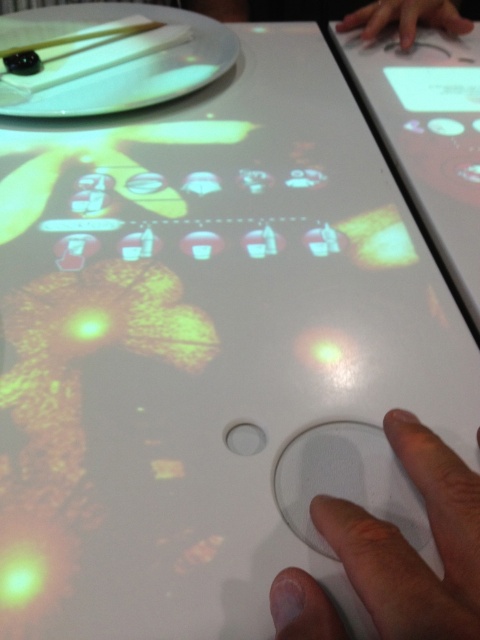
Question: Does transparent plastic hand at bottom right appear on the left side of smooth skin hand at upper right?

Choices:
 (A) yes
 (B) no

Answer: (A)

Question: Which object is farther from the camera taking this photo?

Choices:
 (A) transparent plastic hand at bottom right
 (B) smooth skin hand at upper right

Answer: (B)

Question: Does transparent plastic hand at bottom right have a smaller size compared to smooth skin hand at upper right?

Choices:
 (A) yes
 (B) no

Answer: (A)

Question: Does transparent plastic hand at bottom right have a greater width compared to smooth skin hand at upper right?

Choices:
 (A) yes
 (B) no

Answer: (B)